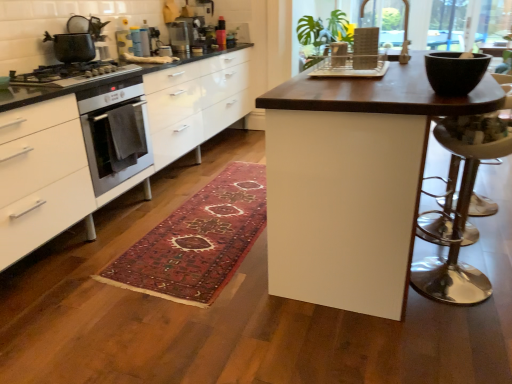
Question: Would you say metallic silver toaster at upper center, acting as the 3th appliance starting from the right, is outside polished silver bar stool at right?

Choices:
 (A) yes
 (B) no

Answer: (A)

Question: From the image's perspective, would you say metallic silver toaster at upper center, marked as the 2th appliance in a bottom-to-top arrangement, is positioned over polished silver bar stool at right?

Choices:
 (A) yes
 (B) no

Answer: (A)

Question: Does metallic silver toaster at upper center, the second appliance when ordered from back to front, have a greater height compared to polished silver bar stool at right?

Choices:
 (A) yes
 (B) no

Answer: (B)

Question: Is the depth of metallic silver toaster at upper center, positioned as the 2th appliance in front-to-back order, greater than that of polished silver bar stool at right?

Choices:
 (A) no
 (B) yes

Answer: (B)

Question: Considering the relative sizes of metallic silver toaster at upper center, the second appliance when ordered from back to front, and polished silver bar stool at right in the image provided, is metallic silver toaster at upper center, the second appliance when ordered from back to front, smaller than polished silver bar stool at right?

Choices:
 (A) yes
 (B) no

Answer: (A)

Question: Is wooden lattice at upper right oriented towards matte plastic dish rack at center, arranged as the first appliance when viewed from the right?

Choices:
 (A) yes
 (B) no

Answer: (B)

Question: Are wooden lattice at upper right and matte plastic dish rack at center, placed as the third appliance when sorted from top to bottom, far apart?

Choices:
 (A) no
 (B) yes

Answer: (A)

Question: From a real-world perspective, is wooden lattice at upper right beneath matte plastic dish rack at center, placed as the first appliance when sorted from bottom to top?

Choices:
 (A) yes
 (B) no

Answer: (B)

Question: Considering the relative positions of wooden lattice at upper right and matte plastic dish rack at center, which is counted as the 3th appliance, starting from the back, in the image provided, is wooden lattice at upper right to the left of matte plastic dish rack at center, which is counted as the 3th appliance, starting from the back, from the viewer's perspective?

Choices:
 (A) no
 (B) yes

Answer: (A)

Question: Considering the relative sizes of wooden lattice at upper right and matte plastic dish rack at center, arranged as the first appliance when viewed from the right, in the image provided, is wooden lattice at upper right wider than matte plastic dish rack at center, arranged as the first appliance when viewed from the right,?

Choices:
 (A) no
 (B) yes

Answer: (B)

Question: Is wooden lattice at upper right thinner than matte plastic dish rack at center, placed as the third appliance when sorted from top to bottom?

Choices:
 (A) yes
 (B) no

Answer: (B)

Question: Is polished silver bar stool at right wider than translucent plastic blender at upper center, placed as the 2th appliance when sorted from right to left?

Choices:
 (A) no
 (B) yes

Answer: (B)